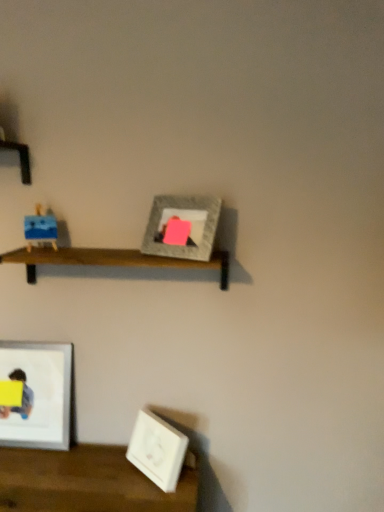
Question: Can you confirm if wooden shelf at center is bigger than yellow matte paper at lower left?

Choices:
 (A) yes
 (B) no

Answer: (A)

Question: From the image's perspective, does wooden shelf at center appear higher than yellow matte paper at lower left?

Choices:
 (A) no
 (B) yes

Answer: (B)

Question: From the image's perspective, is wooden shelf at center beneath yellow matte paper at lower left?

Choices:
 (A) yes
 (B) no

Answer: (B)

Question: Is wooden shelf at center closer to the viewer compared to yellow matte paper at lower left?

Choices:
 (A) no
 (B) yes

Answer: (B)

Question: Is wooden shelf at center oriented towards yellow matte paper at lower left?

Choices:
 (A) no
 (B) yes

Answer: (A)

Question: From their relative heights in the image, would you say white glossy picture frame at lower left, arranged as the second picture frame when ordered from the bottom, is taller or shorter than matte blue toy at left?

Choices:
 (A) tall
 (B) short

Answer: (A)

Question: Would you say white glossy picture frame at lower left, arranged as the second picture frame when ordered from the bottom, is to the left or to the right of matte blue toy at left in the picture?

Choices:
 (A) right
 (B) left

Answer: (B)

Question: Considering the positions of white glossy picture frame at lower left, positioned as the third picture frame in right-to-left order, and matte blue toy at left in the image, is white glossy picture frame at lower left, positioned as the third picture frame in right-to-left order, bigger or smaller than matte blue toy at left?

Choices:
 (A) small
 (B) big

Answer: (B)

Question: From a real-world perspective, is white glossy picture frame at lower left, which is the second picture frame from top to bottom, physically located above or below matte blue toy at left?

Choices:
 (A) below
 (B) above

Answer: (A)

Question: Considering their positions, is white glossy picture frame at lower left, which is the second picture frame from top to bottom, located in front of or behind white matte picture frame at lower right, which is counted as the second picture frame, starting from the left?

Choices:
 (A) front
 (B) behind

Answer: (B)

Question: Considering the positions of white glossy picture frame at lower left, which is the second picture frame from top to bottom, and white matte picture frame at lower right, which is counted as the second picture frame, starting from the left, in the image, is white glossy picture frame at lower left, which is the second picture frame from top to bottom, wider or thinner than white matte picture frame at lower right, which is counted as the second picture frame, starting from the left,?

Choices:
 (A) thin
 (B) wide

Answer: (A)

Question: Is white glossy picture frame at lower left, the first picture frame when ordered from left to right, spatially inside white matte picture frame at lower right, placed as the 2th picture frame when sorted from right to left, or outside of it?

Choices:
 (A) inside
 (B) outside

Answer: (B)

Question: In terms of height, does white glossy picture frame at lower left, arranged as the second picture frame when ordered from the bottom, look taller or shorter compared to white matte picture frame at lower right, positioned as the 1th picture frame in bottom-to-top order?

Choices:
 (A) tall
 (B) short

Answer: (A)

Question: Is matte gray picture frame at center, which is the 3th picture frame from bottom to top, bigger or smaller than wooden shelf at center?

Choices:
 (A) big
 (B) small

Answer: (B)

Question: Considering their positions, is matte gray picture frame at center, which is the 3th picture frame from bottom to top, located in front of or behind wooden shelf at center?

Choices:
 (A) front
 (B) behind

Answer: (A)